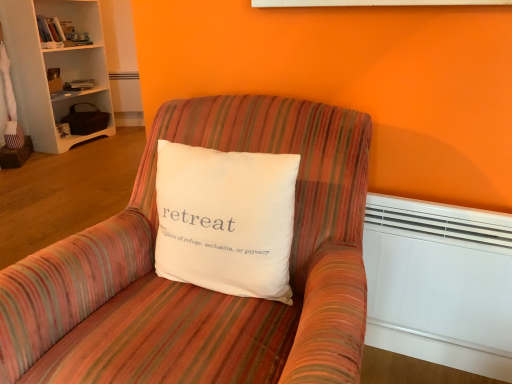
Question: Considering the relative sizes of white wood bookcase at upper left and white plastic heater at lower right in the image provided, is white wood bookcase at upper left wider than white plastic heater at lower right?

Choices:
 (A) yes
 (B) no

Answer: (A)

Question: Are white wood bookcase at upper left and white plastic heater at lower right far apart?

Choices:
 (A) yes
 (B) no

Answer: (A)

Question: From the image's perspective, is white wood bookcase at upper left beneath white plastic heater at lower right?

Choices:
 (A) no
 (B) yes

Answer: (A)

Question: From a real-world perspective, is white wood bookcase at upper left located higher than white plastic heater at lower right?

Choices:
 (A) no
 (B) yes

Answer: (B)

Question: Is white wood bookcase at upper left bigger than white plastic heater at lower right?

Choices:
 (A) no
 (B) yes

Answer: (B)

Question: Does white wood bookcase at upper left have a greater height compared to white plastic heater at lower right?

Choices:
 (A) no
 (B) yes

Answer: (B)

Question: Is there a large distance between white wood bookcase at upper left and white cotton pillow at center?

Choices:
 (A) yes
 (B) no

Answer: (A)

Question: Is white wood bookcase at upper left facing away from white cotton pillow at center?

Choices:
 (A) yes
 (B) no

Answer: (B)

Question: Can you confirm if white wood bookcase at upper left is positioned to the right of white cotton pillow at center?

Choices:
 (A) no
 (B) yes

Answer: (A)

Question: Are white wood bookcase at upper left and white cotton pillow at center beside each other?

Choices:
 (A) yes
 (B) no

Answer: (B)

Question: Could you tell me if white wood bookcase at upper left is facing white cotton pillow at center?

Choices:
 (A) yes
 (B) no

Answer: (B)

Question: Is white wood bookcase at upper left shorter than white cotton pillow at center?

Choices:
 (A) yes
 (B) no

Answer: (B)

Question: From a real-world perspective, does white plastic heater at lower right sit lower than white cotton pillow at center?

Choices:
 (A) yes
 (B) no

Answer: (A)